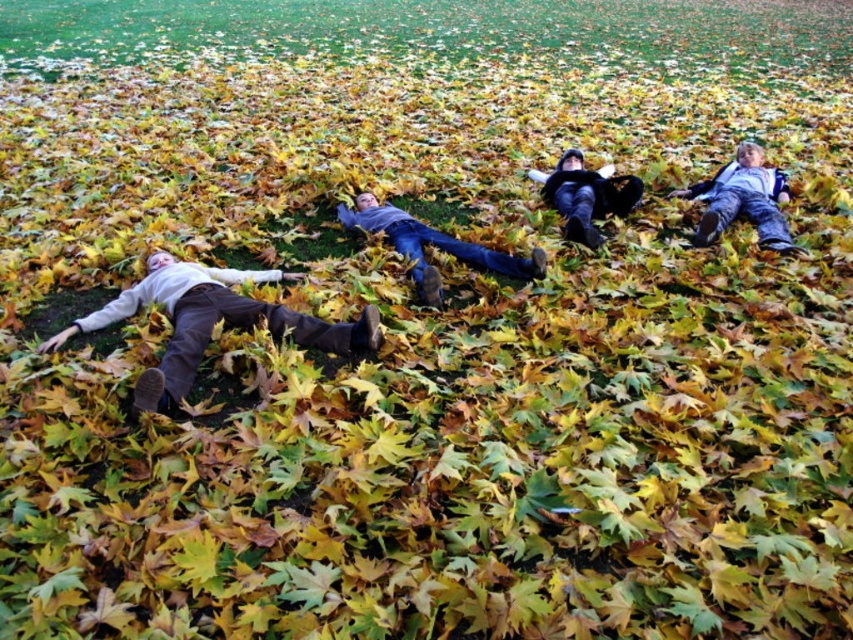
Question: Estimate the real-world distances between objects in this image. Which object is farther from the green grass at upper center?

Choices:
 (A) matte gray sweater at left
 (B) gray sweater at center

Answer: (A)

Question: Based on their relative distances, which object is nearer to the dark gray sweater at center?

Choices:
 (A) matte gray sweater at left
 (B) green grass at upper center

Answer: (A)

Question: Does gray sweater at center have a larger size compared to dark gray sweater at center?

Choices:
 (A) no
 (B) yes

Answer: (B)

Question: Which of the following is the farthest from the observer?

Choices:
 (A) (422, 250)
 (B) (334, 42)
 (C) (189, 266)

Answer: (B)

Question: Does gray sweater at center appear on the left side of dark gray sweater at center?

Choices:
 (A) yes
 (B) no

Answer: (A)

Question: Does green grass at upper center appear on the left side of dark gray sweater at center?

Choices:
 (A) yes
 (B) no

Answer: (B)